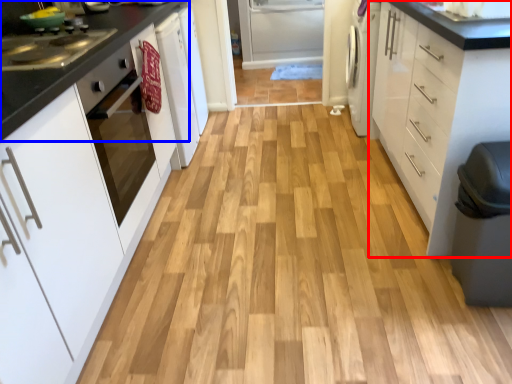
Question: Which of the following is the farthest to the observer, cabinetry (highlighted by a red box) or countertop (highlighted by a blue box)?

Choices:
 (A) cabinetry
 (B) countertop

Answer: (B)